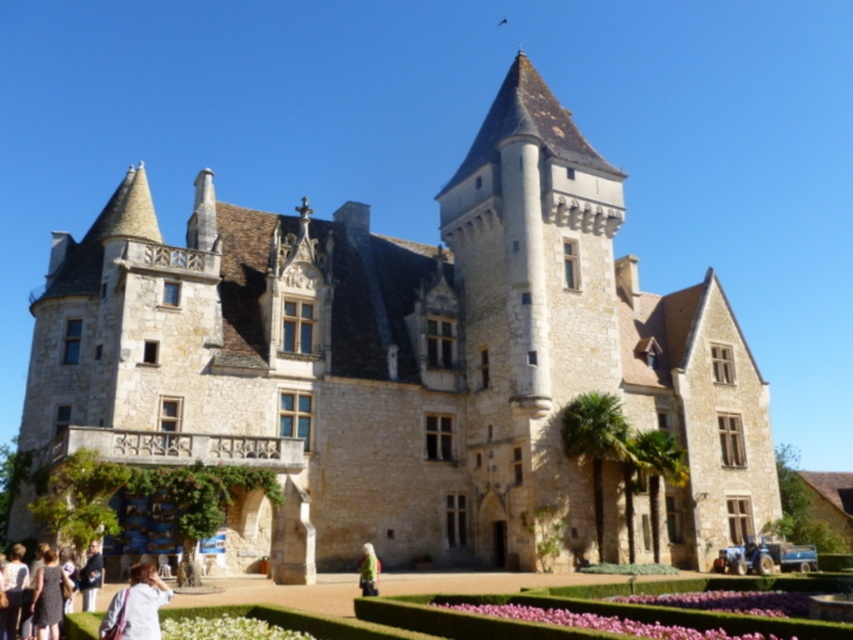
Question: Is pink floral bed at lower center below light brown leather jacket at lower left?

Choices:
 (A) no
 (B) yes

Answer: (B)

Question: Which is farther from the dark brown leather jacket at lower left?

Choices:
 (A) green fabric jacket at lower center
 (B) light beige fabric at lower left
 (C) white cotton shirt at lower left
 (D) pink velvet flower at lower center

Answer: (D)

Question: Is white matte flower at lower center above green fabric jacket at lower center?

Choices:
 (A) yes
 (B) no

Answer: (A)

Question: Does white matte flower at lower center appear on the left side of dark brown leather jacket at lower left?

Choices:
 (A) no
 (B) yes

Answer: (A)

Question: Among these points, which one is nearest to the camera?

Choices:
 (A) (698, 602)
 (B) (15, 582)

Answer: (B)

Question: Among these points, which one is farthest from the camera?

Choices:
 (A) (45, 634)
 (B) (717, 600)

Answer: (B)